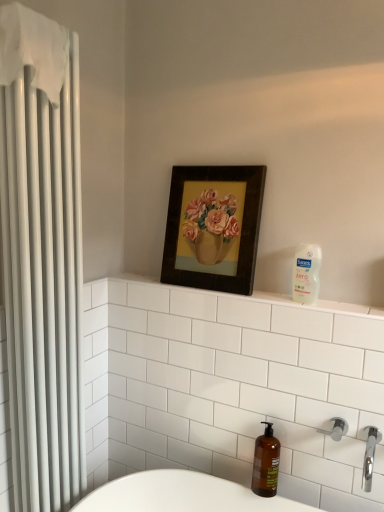
Where is `blank space situated above wooden framed painting of flowers at upper center (from a real-world perspective)`? blank space situated above wooden framed painting of flowers at upper center (from a real-world perspective) is located at coordinates (221, 150).